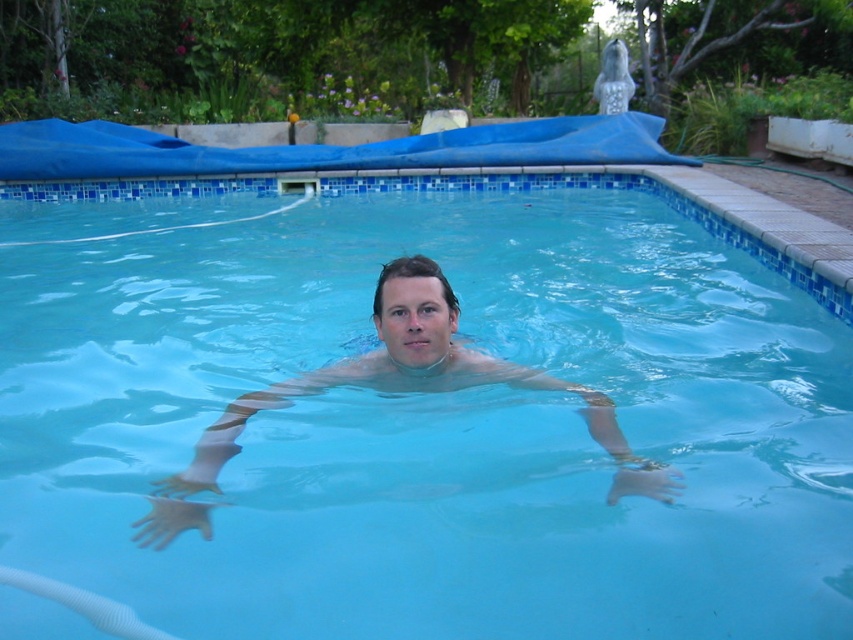
Question: Does transparent blue water at center appear over clear skin at center?

Choices:
 (A) yes
 (B) no

Answer: (A)

Question: Is transparent blue water at center smaller than clear skin at center?

Choices:
 (A) no
 (B) yes

Answer: (A)

Question: Is transparent blue water at center closer to camera compared to clear skin at center?

Choices:
 (A) no
 (B) yes

Answer: (B)

Question: Among these points, which one is nearest to the camera?

Choices:
 (A) (402, 340)
 (B) (786, 305)

Answer: (A)

Question: Which of the following is the farthest from the observer?

Choices:
 (A) clear skin at center
 (B) transparent blue water at center

Answer: (A)

Question: Which of the following is the farthest from the observer?

Choices:
 (A) (718, 566)
 (B) (599, 417)

Answer: (B)